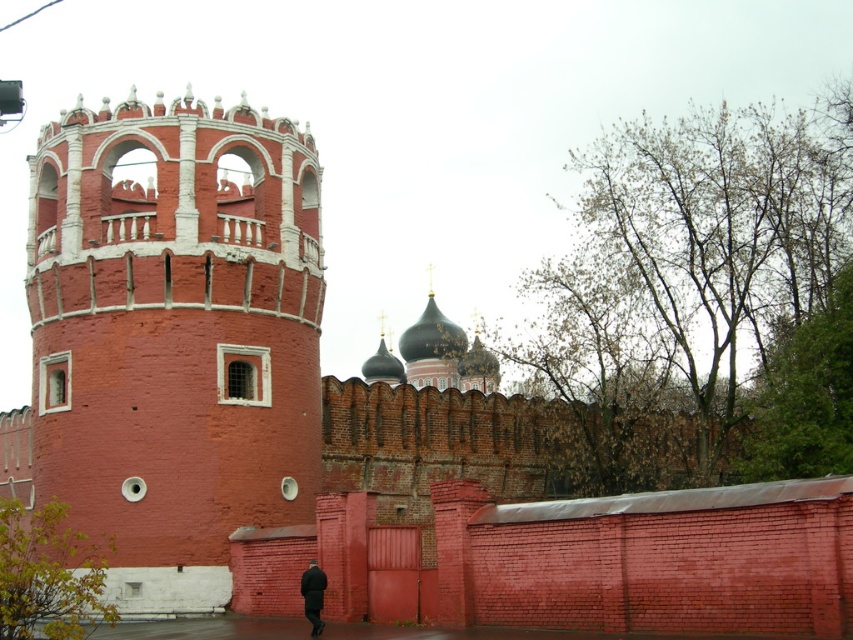
You are a painter who needs to paint both the smooth brick tower at center and the black matte coat at lower center. Which object requires more paint due to its size?

The smooth brick tower at center requires more paint because it is larger in size than the black matte coat at lower center.

You are a tourist standing in front of the historic brick structure. There is a smooth brick tower at center and a black matte coat at lower center. Which object is closer to you?

The smooth brick tower at center is closer to you because it is in front of the black matte coat at lower center.

What is located at the coordinates point [171,339]?

The smooth brick tower at center is located at point [171,339].